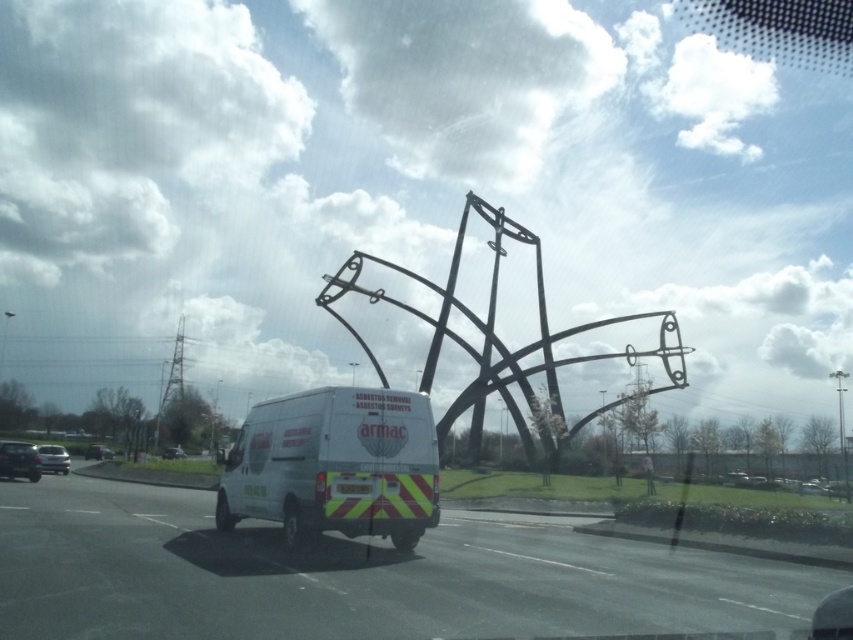
You are driving a car and see the shiny black car at lower left and the white van at center. How far apart are they from each other?

The white van at center is 52.18 meters away from the shiny black car at lower left.

You are a driver trying to park your car behind the white van at center and the shiny silver car at lower left. Which vehicle should you park behind so that your car is not blocked by the other vehicles?

You should park behind the shiny silver car at lower left because the white van at center is much taller and would block your view or access more than the shiny silver car at lower left.

You are driving a car and want to safely pass the white van at center. The recommended safe distance to maintain while passing is at least 8 meters. Can you safely pass the van at this moment?

The white van at center is 7.77 meters from the camera, which is less than the recommended 8 meters safe distance. Therefore, you cannot safely pass the van at this moment.